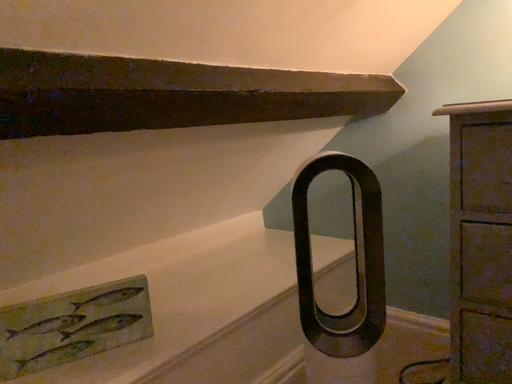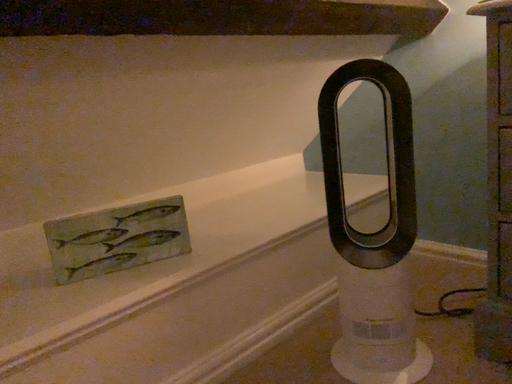
Question: How did the camera likely rotate when shooting the video?

Choices:
 (A) rotated right
 (B) rotated left

Answer: (B)